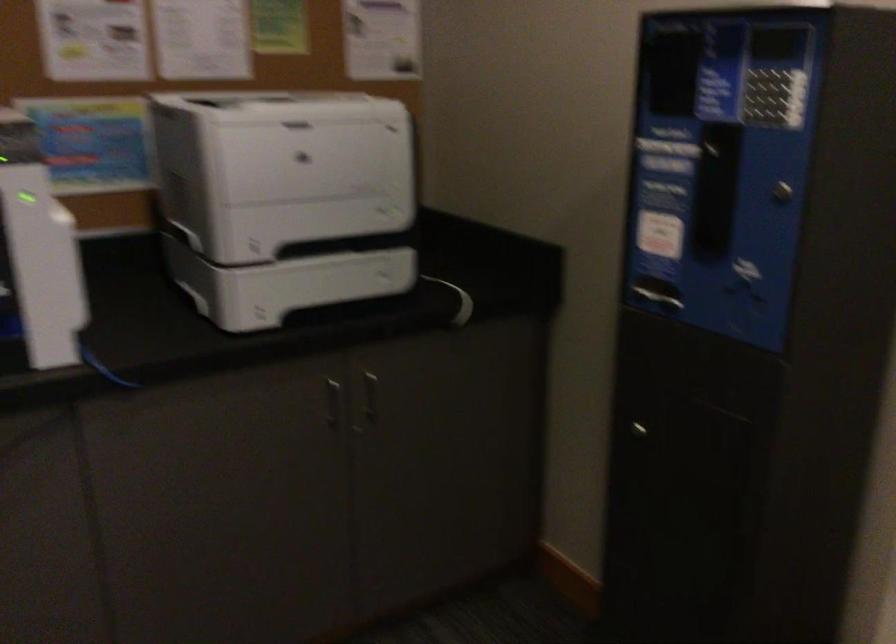
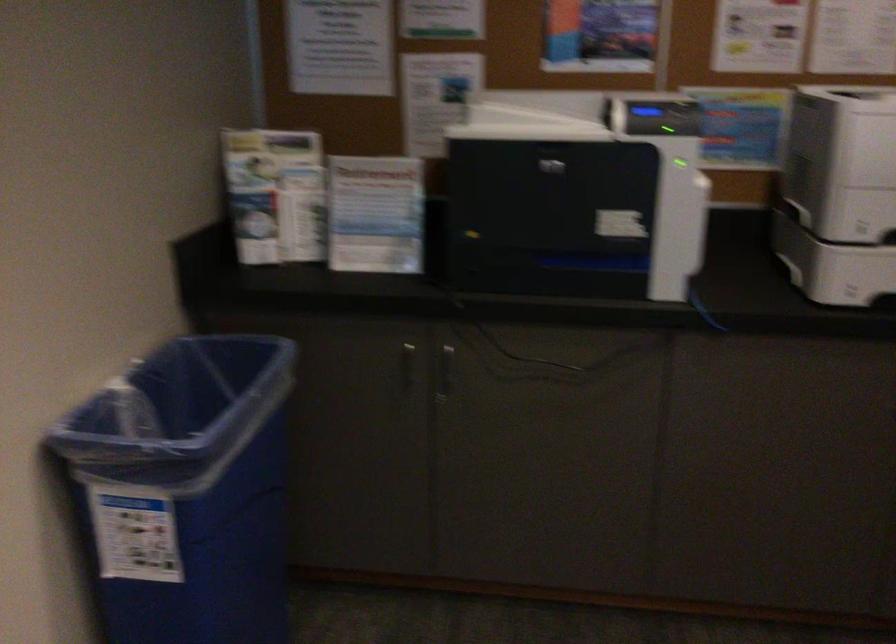
Question: How did the camera likely rotate?

Choices:
 (A) Left
 (B) Right
 (C) Up
 (D) Down

Answer: (A)